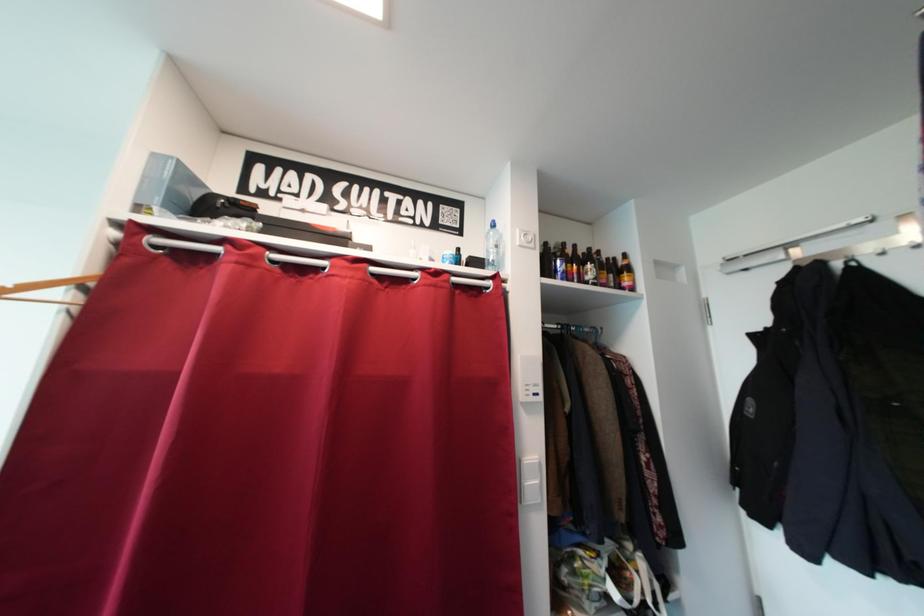
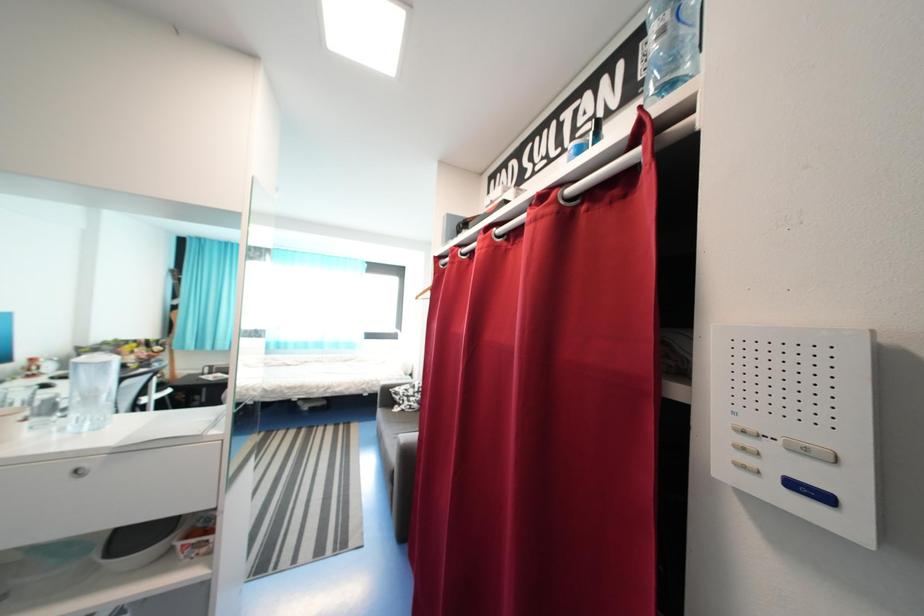
Question: How did the camera likely rotate?

Choices:
 (A) Left
 (B) Right
 (C) Up
 (D) Down

Answer: (A)